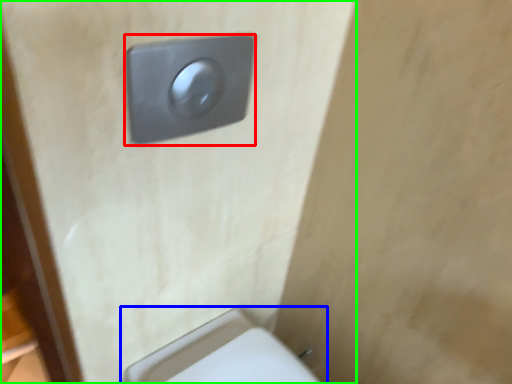
Question: Which object is the farthest from light switch (highlighted by a red box)? Choose among these: toilet (highlighted by a blue box) or door (highlighted by a green box).

Choices:
 (A) toilet
 (B) door

Answer: (A)